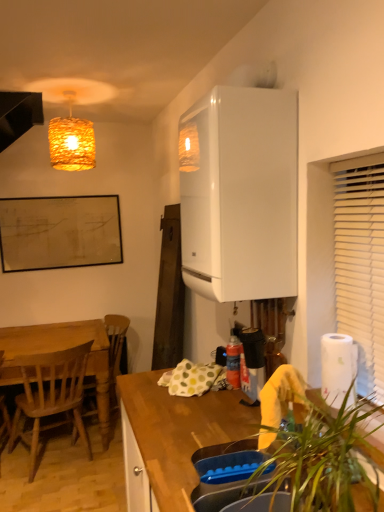
Question: Considering the relative sizes of white paper at right and woven straw lampshade at upper left in the image provided, is white paper at right thinner than woven straw lampshade at upper left?

Choices:
 (A) no
 (B) yes

Answer: (B)

Question: Is white paper at right facing away from woven straw lampshade at upper left?

Choices:
 (A) no
 (B) yes

Answer: (A)

Question: Can you confirm if white paper at right is wider than woven straw lampshade at upper left?

Choices:
 (A) yes
 (B) no

Answer: (B)

Question: From the image's perspective, is white paper at right under woven straw lampshade at upper left?

Choices:
 (A) yes
 (B) no

Answer: (A)

Question: Could you tell me if white paper at right is turned towards woven straw lampshade at upper left?

Choices:
 (A) yes
 (B) no

Answer: (B)

Question: Considering their positions, is white paper at right located in front of or behind white glossy boiler at upper right?

Choices:
 (A) front
 (B) behind

Answer: (A)

Question: From a real-world perspective, is white paper at right above or below white glossy boiler at upper right?

Choices:
 (A) below
 (B) above

Answer: (A)

Question: In terms of height, does white paper at right look taller or shorter compared to white glossy boiler at upper right?

Choices:
 (A) tall
 (B) short

Answer: (B)

Question: Looking at their shapes, would you say white paper at right is wider or thinner than white glossy boiler at upper right?

Choices:
 (A) wide
 (B) thin

Answer: (B)

Question: Is black matte exhaust hood at upper left to the left or to the right of wooden chair at left, which is the 1th chair from front to back, in the image?

Choices:
 (A) right
 (B) left

Answer: (B)

Question: Is black matte exhaust hood at upper left situated inside wooden chair at left, which is the 1th chair from front to back, or outside?

Choices:
 (A) inside
 (B) outside

Answer: (B)

Question: Is black matte exhaust hood at upper left wider or thinner than wooden chair at left, which is the 1th chair from front to back?

Choices:
 (A) thin
 (B) wide

Answer: (A)

Question: From a real-world perspective, is black matte exhaust hood at upper left positioned above or below wooden chair at left, the second chair from the back?

Choices:
 (A) below
 (B) above

Answer: (B)

Question: Considering the positions of woven straw lampshade at upper left and wooden at lower right in the image, is woven straw lampshade at upper left wider or thinner than wooden at lower right?

Choices:
 (A) wide
 (B) thin

Answer: (B)

Question: In the image, is woven straw lampshade at upper left positioned in front of or behind wooden at lower right?

Choices:
 (A) front
 (B) behind

Answer: (B)